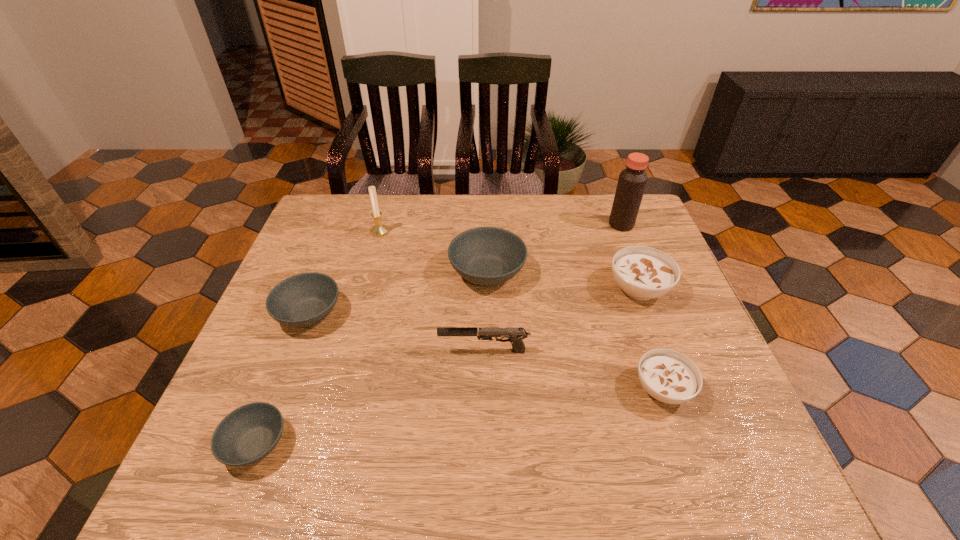
The image size is (960, 540). In order to click on the nearer white soup bowl in this screenshot , I will do `click(670, 377)`.

I want to click on the shortest soup bowl, so click(248, 434).

Where is `the nearest gray soup bowl`? This screenshot has width=960, height=540. the nearest gray soup bowl is located at coordinates (248, 434).

Where is `free space located on the left of the tallest object`? This screenshot has height=540, width=960. free space located on the left of the tallest object is located at coordinates pos(580,225).

Where is `vacant space situated 0.280m on the front of the candle holder`? Image resolution: width=960 pixels, height=540 pixels. vacant space situated 0.280m on the front of the candle holder is located at coordinates (360, 305).

Where is `vacant space located on the left of the third soup bowl from left to right`? vacant space located on the left of the third soup bowl from left to right is located at coordinates (311, 272).

Identify the location of free space located 0.240m on the back of the farther white soup bowl. (612, 217).

At what (x,y) coordinates should I click in order to perform the action: click on blank space located 0.090m at the muzzle end of the third nearest object. Please return your answer as a coordinate pair (x, y). Looking at the image, I should click on (400, 351).

I want to click on vacant space located 0.390m at the muzzle end of the third nearest object, so click(270, 351).

Where is `free point located 0.050m at the muzzle end of the third nearest object`? The width and height of the screenshot is (960, 540). free point located 0.050m at the muzzle end of the third nearest object is located at coordinates (418, 351).